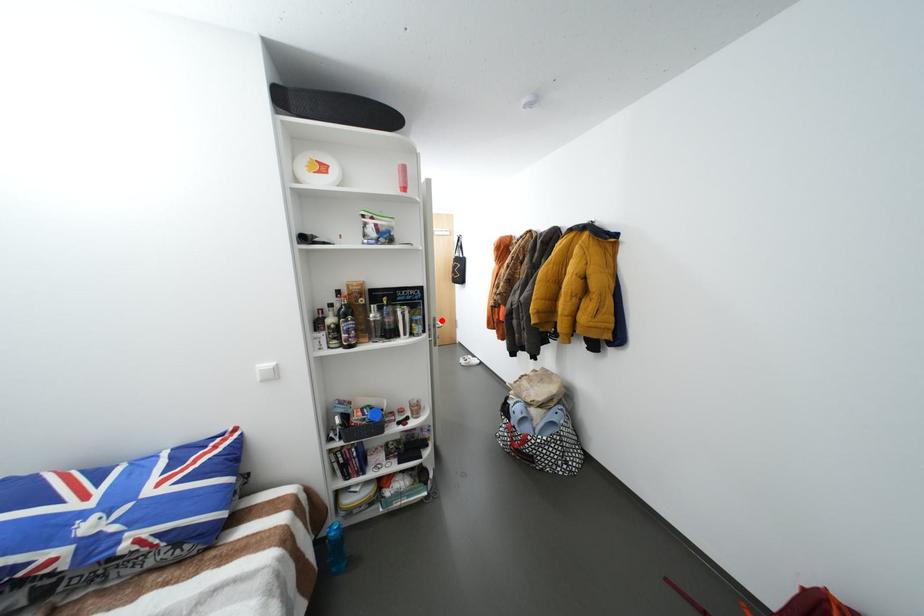
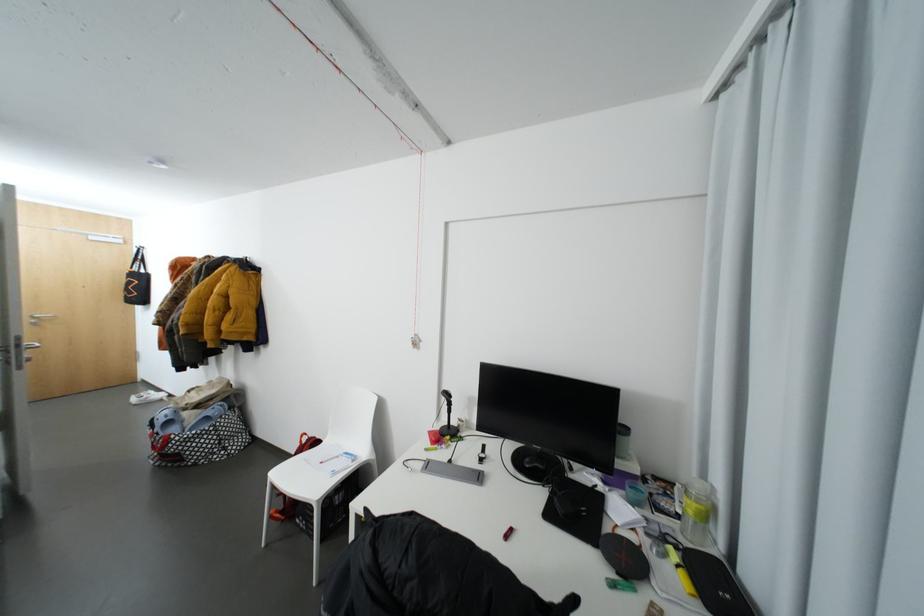
Question: I am providing you with two images of the same scene from different viewpoints. Image1 has a red point marked. In image2, the corresponding 3D location appears at what relative position? Reply with the corresponding letter.

Choices:
 (A) Closer
 (B) Farther

Answer: (B)